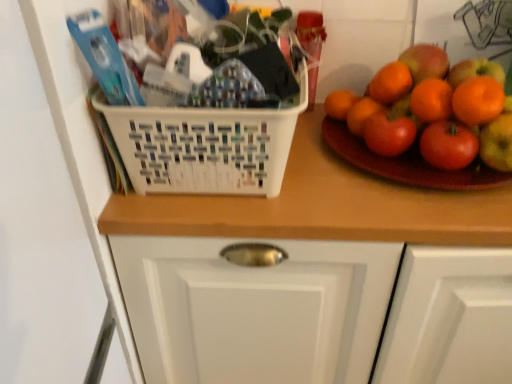
At what (x,y) coordinates should I click in order to perform the action: click on wooden counter at center. Please return your answer as a coordinate pair (x, y). This screenshot has height=384, width=512. Looking at the image, I should click on click(x=322, y=206).

Describe the element at coordinates (422, 106) in the screenshot. I see `glossy wooden plate at right` at that location.

What is the approximate height of white plastic basket at center?

white plastic basket at center is 5.29 inches tall.

I want to click on wooden counter at center, so (x=322, y=206).

Is glossy wooden plate at right completely or partially inside white plastic basket at center?

That's incorrect, glossy wooden plate at right is not inside white plastic basket at center.

Which is more to the left, white plastic basket at center or glossy wooden plate at right?

From the viewer's perspective, white plastic basket at center appears more on the left side.

Does white plastic basket at center have a greater width compared to glossy wooden plate at right?

Yes, white plastic basket at center is wider than glossy wooden plate at right.

This screenshot has width=512, height=384. In order to click on basket above the glossy wooden plate at right (from the image's perspective) in this screenshot , I will do point(205,146).

Does white plastic basket at center appear on the left side of wooden counter at center?

Indeed, white plastic basket at center is positioned on the left side of wooden counter at center.

Relative to wooden counter at center, is white plastic basket at center in front or behind?

In the image, white plastic basket at center appears in front of wooden counter at center.

Is white plastic basket at center outside of wooden counter at center?

white plastic basket at center lies outside wooden counter at center's area.

Is point (178, 147) positioned after point (305, 118)?

No, (178, 147) is in front of (305, 118).

Is wooden counter at center placed right next to white plastic basket at center?

Absolutely, wooden counter at center is next to and touching white plastic basket at center.

Is wooden counter at center shorter than white plastic basket at center?

In fact, wooden counter at center may be taller than white plastic basket at center.

You are a GUI agent. You are given a task and a screenshot of the screen. Output one action in this format:
    pyautogui.click(x=<x>, y=<y>)
    Task: Click on the counter that is under the white plastic basket at center (from a real-world perspective)
    The width and height of the screenshot is (512, 384).
    Given the screenshot: What is the action you would take?
    pyautogui.click(x=322, y=206)

From the image's perspective, which is below, wooden counter at center or glossy wooden plate at right?

wooden counter at center is shown below in the image.

Would you consider wooden counter at center to be distant from glossy wooden plate at right?

No.

Considering the sizes of wooden counter at center and glossy wooden plate at right in the image, is wooden counter at center taller or shorter than glossy wooden plate at right?

wooden counter at center is taller than glossy wooden plate at right.

Looking at the image, does wooden counter at center seem bigger or smaller compared to glossy wooden plate at right?

wooden counter at center is bigger than glossy wooden plate at right.

What's the angular difference between glossy wooden plate at right and wooden counter at center's facing directions?

They differ by 2.69 degrees in their facing directions.

Which is in front, point (503, 97) or point (407, 235)?

The point (407, 235) is in front.

At what (x,y) coordinates should I click in order to perform the action: click on counter located below the glossy wooden plate at right (from the image's perspective). Please return your answer as a coordinate pair (x, y). Looking at the image, I should click on (322, 206).

Based on the photo, visually, is glossy wooden plate at right positioned to the left or to the right of wooden counter at center?

From the image, it's evident that glossy wooden plate at right is to the left of wooden counter at center.

In terms of height, does glossy wooden plate at right look taller or shorter compared to white plastic basket at center?

In the image, glossy wooden plate at right appears to be shorter than white plastic basket at center.

In the scene shown: From the image's perspective, relative to white plastic basket at center, is glossy wooden plate at right above or below?

glossy wooden plate at right is situated lower than white plastic basket at center in the image.

Which object is thinner, glossy wooden plate at right or white plastic basket at center?

glossy wooden plate at right is thinner.

Where is `basket below the glossy wooden plate at right (from a real-world perspective)`? The height and width of the screenshot is (384, 512). basket below the glossy wooden plate at right (from a real-world perspective) is located at coordinates (205, 146).

You are a GUI agent. You are given a task and a screenshot of the screen. Output one action in this format:
    pyautogui.click(x=<x>, y=<y>)
    Task: Click on the counter below the white plastic basket at center (from the image's perspective)
    
    Given the screenshot: What is the action you would take?
    pyautogui.click(x=322, y=206)

Estimate the real-world distances between objects in this image. Which object is closer to wooden counter at center, white plastic basket at center or glossy wooden plate at right?

The object closer to wooden counter at center is white plastic basket at center.

Considering their positions, is wooden counter at center positioned closer to glossy wooden plate at right than white plastic basket at center?

Based on the image, wooden counter at center appears to be nearer to glossy wooden plate at right.

When comparing their distances from wooden counter at center, does glossy wooden plate at right or white plastic basket at center seem further?

Among the two, glossy wooden plate at right is located further to wooden counter at center.

Looking at the image, which one is located closer to white plastic basket at center, wooden counter at center or glossy wooden plate at right?

The object closer to white plastic basket at center is wooden counter at center.

Looking at the image, which one is located closer to white plastic basket at center, glossy wooden plate at right or wooden counter at center?

The object closer to white plastic basket at center is wooden counter at center.

Considering their positions, is white plastic basket at center positioned further to glossy wooden plate at right than wooden counter at center?

Based on the image, white plastic basket at center appears to be further to glossy wooden plate at right.

Where is `fruit between white plastic basket at center and wooden counter at center vertically`? The width and height of the screenshot is (512, 384). fruit between white plastic basket at center and wooden counter at center vertically is located at coordinates (422, 106).